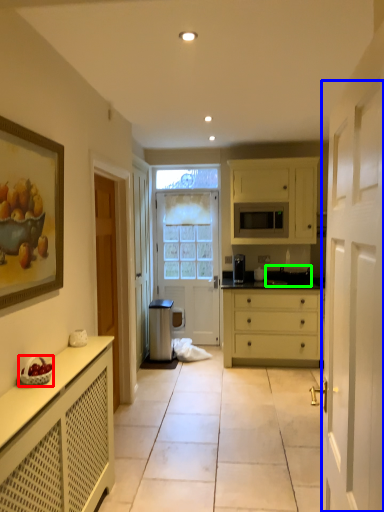
Question: Based on their relative distances, which object is nearer to fruit dish (highlighted by a red box)? Choose from screen door (highlighted by a blue box) and sink (highlighted by a green box).

Choices:
 (A) screen door
 (B) sink

Answer: (A)